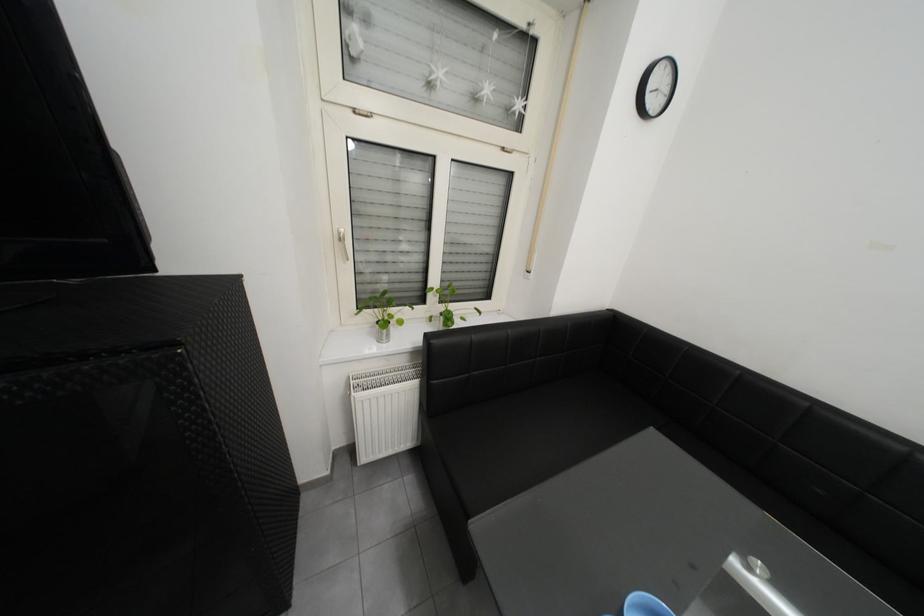
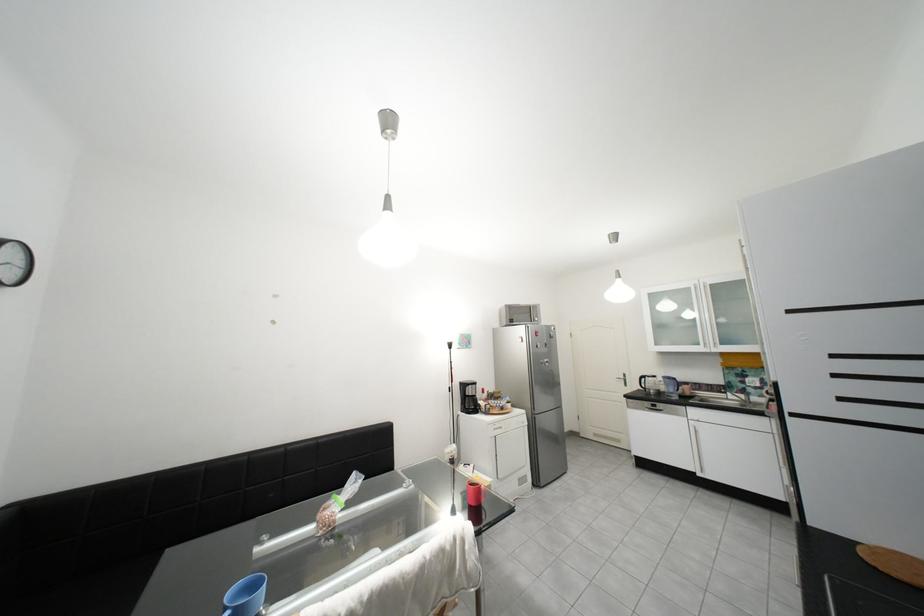
Question: How did the camera likely rotate?

Choices:
 (A) Left
 (B) Right
 (C) Up
 (D) Down

Answer: (B)